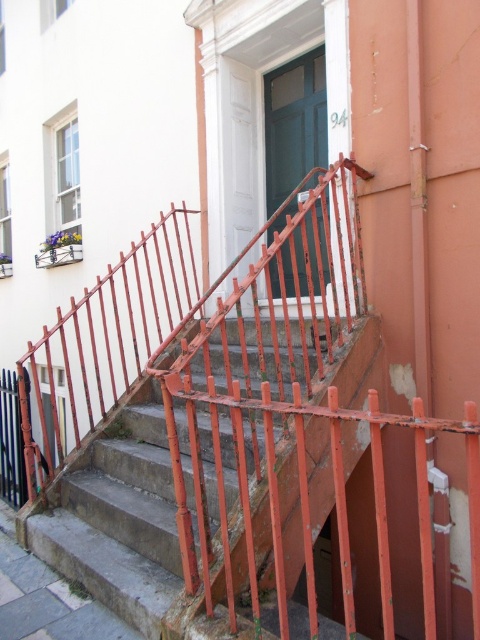
Does rusty metal railing at center appear on the left side of green glossy door at center?

Indeed, rusty metal railing at center is positioned on the left side of green glossy door at center.

Is point (352, 323) less distant than point (305, 67)?

Yes, it is.

You are a GUI agent. You are given a task and a screenshot of the screen. Output one action in this format:
    pyautogui.click(x=<x>, y=<y>)
    Task: Click on the rusty metal railing at center
    The width and height of the screenshot is (480, 640).
    Given the screenshot: What is the action you would take?
    pyautogui.click(x=266, y=435)